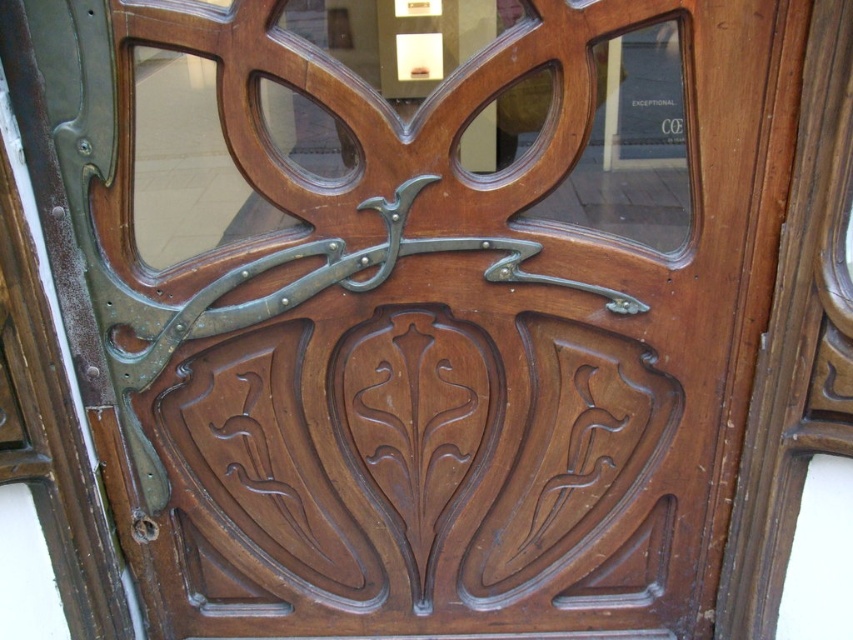
Does brown carved wood at center have a greater height compared to polished brass door handle at center?

Indeed, brown carved wood at center has a greater height compared to polished brass door handle at center.

Is point (363, 376) farther from camera compared to point (608, 291)?

Yes, it is.

Is point (264, 365) behind point (128, 369)?

Yes, point (264, 365) is farther from viewer.

The height and width of the screenshot is (640, 853). I want to click on brown carved wood at center, so click(x=422, y=461).